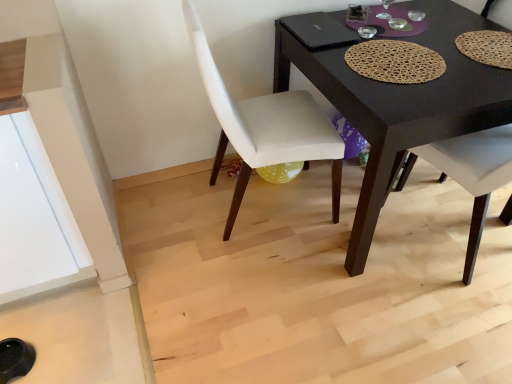
Locate an element on the screen. The image size is (512, 384). unoccupied area in front of black matte desk at center is located at coordinates (368, 315).